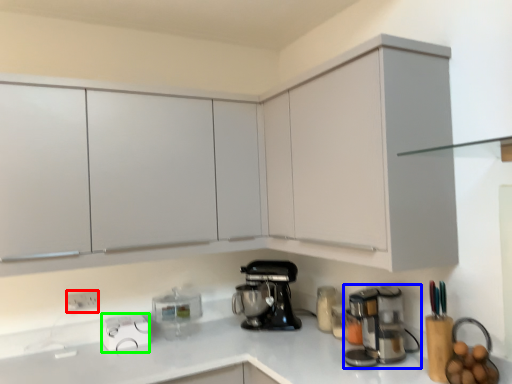
Question: Which is farther away from electric outlet (highlighted by a red box)? home appliance (highlighted by a blue box) or appliance (highlighted by a green box)?

Choices:
 (A) home appliance
 (B) appliance

Answer: (A)